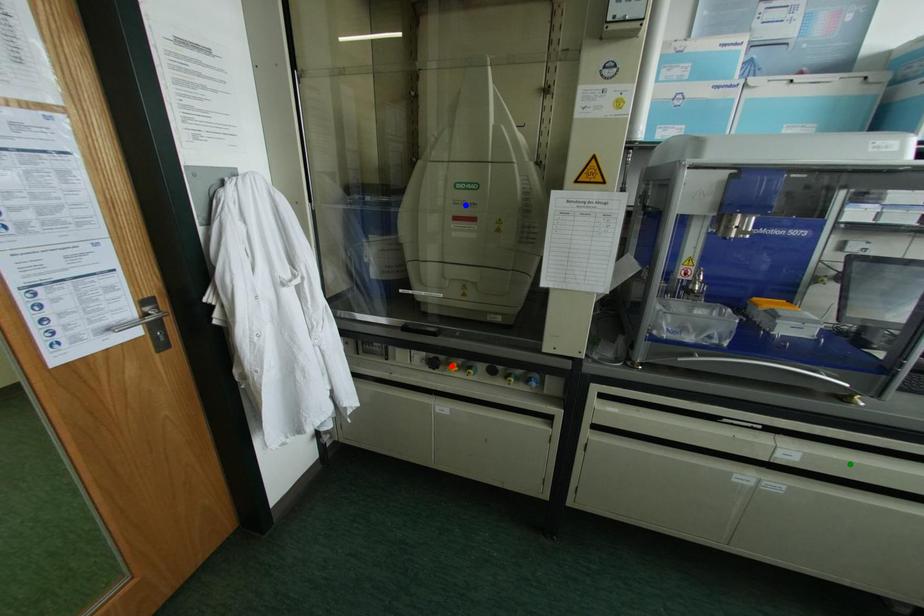
Based on the photo, order these from nearest to farthest:
blue point
green point
red point

green point < blue point < red point